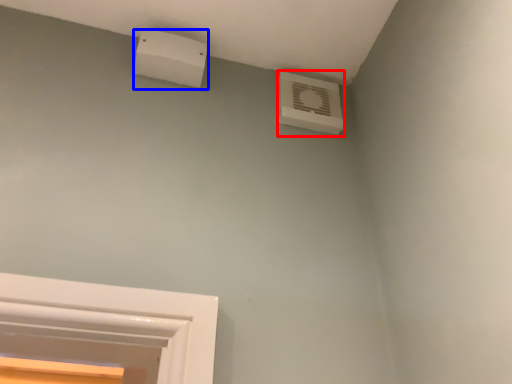
Question: Which point is further to the camera, air conditioning (highlighted by a red box) or air conditioning (highlighted by a blue box)?

Choices:
 (A) air conditioning
 (B) air conditioning

Answer: (A)